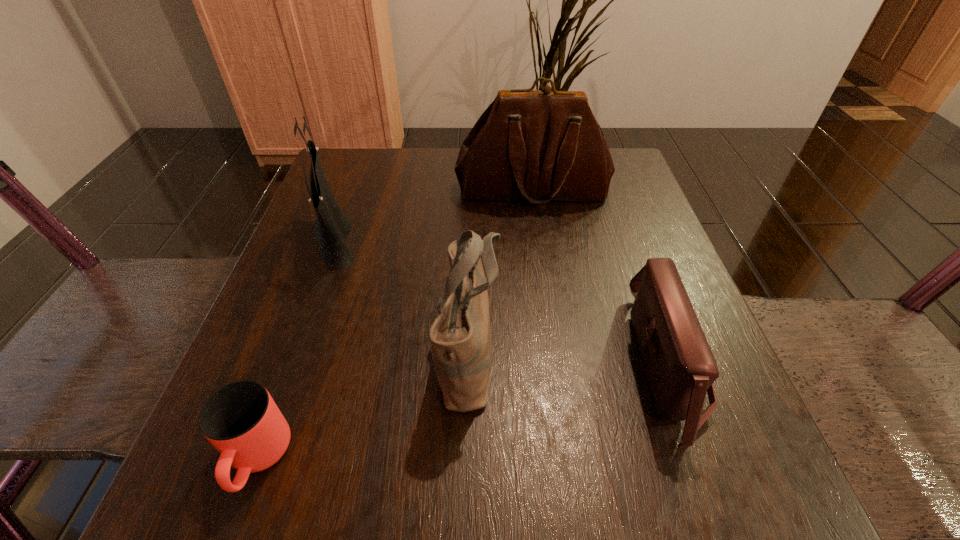
You are a GUI agent. You are given a task and a screenshot of the screen. Output one action in this format:
    pyautogui.click(x=<x>, y=<y>)
    Task: Click on the shoulder bag situated at the left edge
    This screenshot has height=540, width=960.
    Given the screenshot: What is the action you would take?
    pyautogui.click(x=332, y=227)

Where is `cup that is at the left edge`? This screenshot has height=540, width=960. cup that is at the left edge is located at coordinates (241, 420).

In order to click on object at the near left corner in this screenshot , I will do `click(241, 420)`.

The image size is (960, 540). Identify the location of object at the far right corner. (540, 146).

Identify the location of object present at the near right corner. The height and width of the screenshot is (540, 960). (680, 366).

Locate an element on the screen. This screenshot has width=960, height=540. vacant region at the far edge is located at coordinates (x=452, y=158).

In the image, there is a desktop. Where is `vacant space at the near edge`? The width and height of the screenshot is (960, 540). vacant space at the near edge is located at coordinates (489, 453).

At what (x,y) coordinates should I click in order to perform the action: click on vacant region at the left edge. Please return your answer as a coordinate pair (x, y). Looking at the image, I should click on (357, 320).

What are the coordinates of `vacant space at the right edge of the desktop` in the screenshot? It's located at (646, 428).

Where is `vacant area at the far left corner`? The height and width of the screenshot is (540, 960). vacant area at the far left corner is located at coordinates (366, 152).